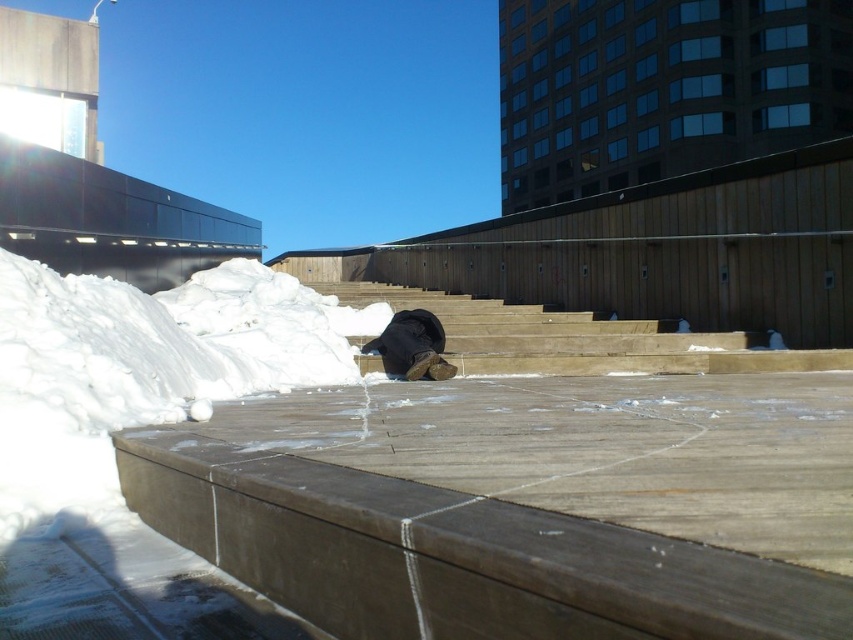
Question: In this image, where is white fluffy snow at lower left located relative to wooden at center?

Choices:
 (A) right
 (B) left

Answer: (B)

Question: Which of the following is the closest to the observer?

Choices:
 (A) matte black hat at center
 (B) white fluffy snow at lower left
 (C) wooden at center

Answer: (B)

Question: Which point appears farthest from the camera in this image?

Choices:
 (A) (434, 348)
 (B) (21, 444)
 (C) (619, 340)

Answer: (C)

Question: Where is white fluffy snow at lower left located in relation to matte black hat at center in the image?

Choices:
 (A) above
 (B) below

Answer: (A)

Question: Can you confirm if wooden at center is positioned to the left of matte black hat at center?

Choices:
 (A) no
 (B) yes

Answer: (A)

Question: Which of the following is the farthest from the observer?

Choices:
 (A) wooden at center
 (B) matte black hat at center

Answer: (A)